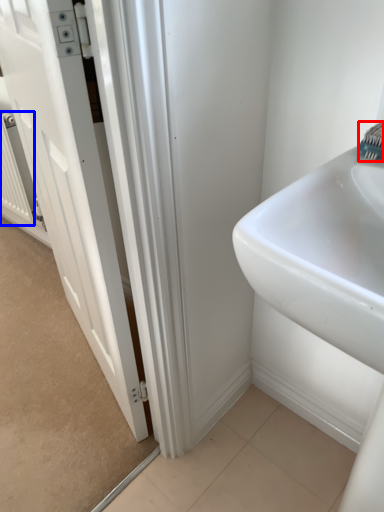
Question: Which of the following is the closest to the observer, brush (highlighted by a red box) or radiator (highlighted by a blue box)?

Choices:
 (A) brush
 (B) radiator

Answer: (A)